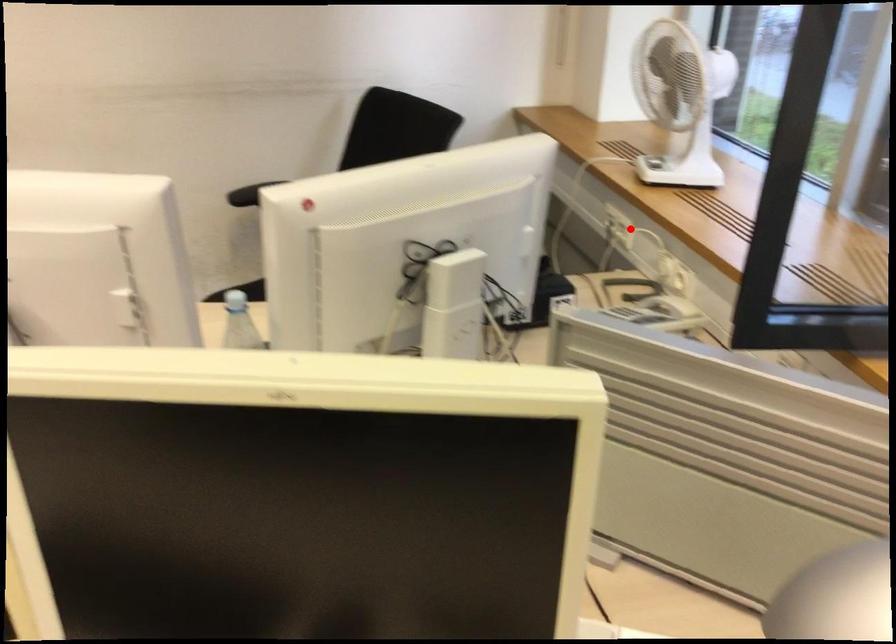
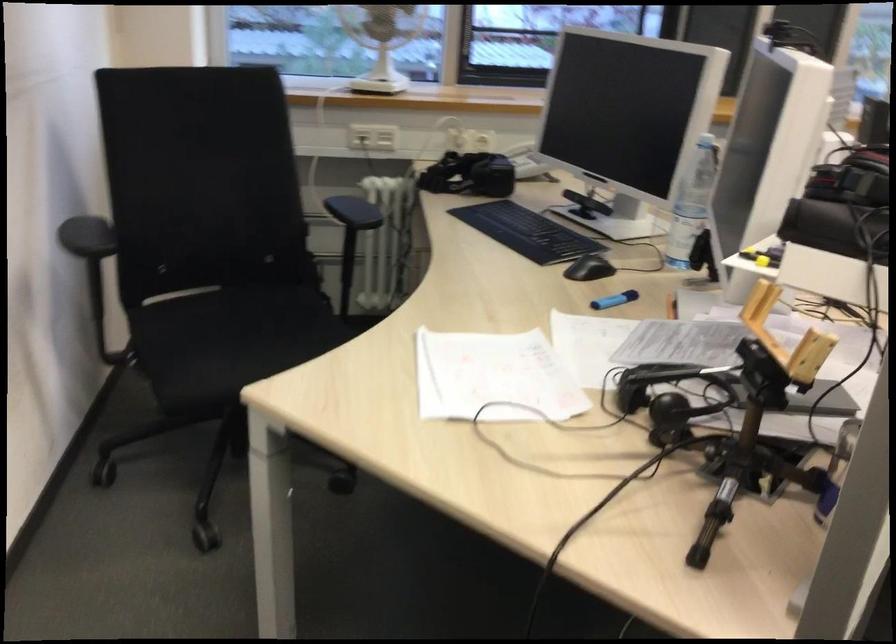
Question: I am providing you with two images of the same scene from different viewpoints. In image1, a red point is highlighted. Considering the same 3D point in image2, which of the following is correct?

Choices:
 (A) It is closer
 (B) It is farther

Answer: (B)